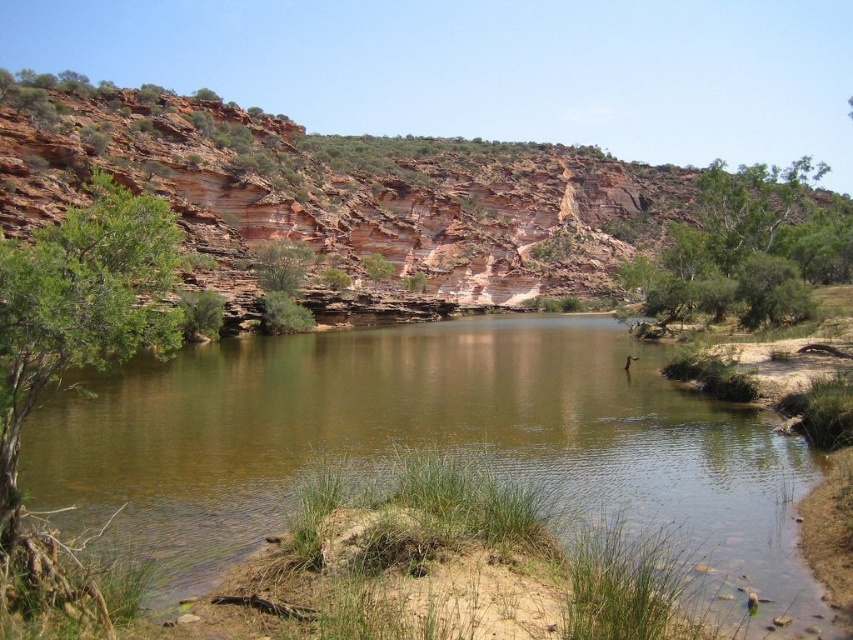
Is brown sedimentary rock at center smaller than green leafy tree at upper center?

Yes.

Is brown sedimentary rock at center shorter than green leafy tree at upper center?

Yes.

Is point (726, 404) farther from viewer compared to point (693, 307)?

No, it is in front of (693, 307).

Locate an element on the screen. The image size is (853, 640). brown sedimentary rock at center is located at coordinates (431, 445).

Between point (30, 172) and point (732, 188), which one is positioned in front?

Point (30, 172) is more forward.

Who is more distant from viewer, (177, 116) or (747, 196)?

The point (177, 116) is behind.

Where is `reddish-brown rock cliff at upper center`? The image size is (853, 640). reddish-brown rock cliff at upper center is located at coordinates (347, 189).

Does point (125, 420) come farther from viewer compared to point (555, 278)?

No, it is in front of (555, 278).

Locate an element on the screen. This screenshot has height=640, width=853. brown sedimentary rock at center is located at coordinates (431, 445).

You are a GUI agent. You are given a task and a screenshot of the screen. Output one action in this format:
    pyautogui.click(x=<x>, y=<y>)
    Task: Click on the brown sedimentary rock at center
    
    Given the screenshot: What is the action you would take?
    pyautogui.click(x=431, y=445)